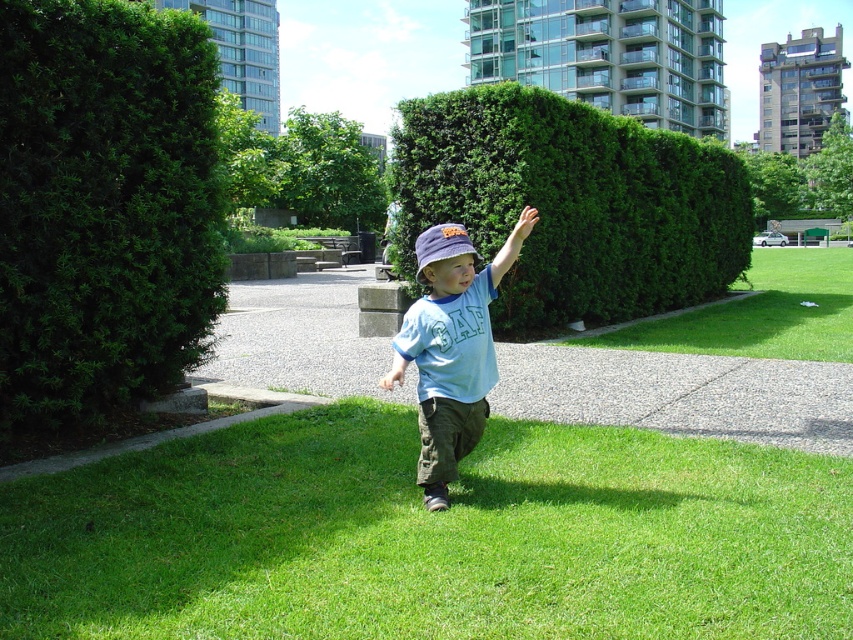
You are a landscape architect designing a garden and want to place the green leafy bush at left and the green leafy hedge at upper center. Which one should be placed closer to the entrance to ensure it doesn

The green leafy bush at left is smaller than the green leafy hedge at upper center, so placing the smaller bush closer to the entrance would allow visitors to see it better while the larger hedge can be positioned further back for a balanced layout.